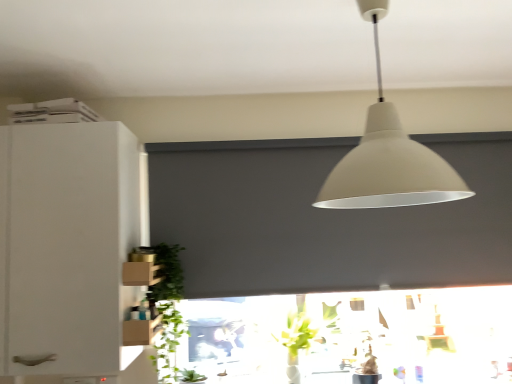
The height and width of the screenshot is (384, 512). Describe the element at coordinates (66, 244) in the screenshot. I see `white matte cabinet at left` at that location.

This screenshot has height=384, width=512. In order to click on matte white lampshade at upper center in this screenshot , I will do `click(388, 157)`.

Where is `green leafy plant at lower left`? Image resolution: width=512 pixels, height=384 pixels. green leafy plant at lower left is located at coordinates (168, 307).

Locate an element on the screen. matte gray window screen at center is located at coordinates (325, 219).

Who is shorter, white matte cabinet at left or matte white lampshade at upper center?

Standing shorter between the two is matte white lampshade at upper center.

At what (x,y) coordinates should I click in order to perform the action: click on cabinetry on the left of matte white lampshade at upper center. Please return your answer as a coordinate pair (x, y). This screenshot has width=512, height=384. Looking at the image, I should click on (66, 244).

Is white matte cabinet at left oriented away from matte white lampshade at upper center?

white matte cabinet at left is not turned away from matte white lampshade at upper center.

Can you tell me how much white matte cabinet at left and matte white lampshade at upper center differ in facing direction?

There is a 91-degree angle between the facing directions of white matte cabinet at left and matte white lampshade at upper center.

Based on the photo, which object is thinner, matte white lampshade at upper center or matte gray window screen at center?

matte gray window screen at center is thinner.

From a real-world perspective, is matte white lampshade at upper center positioned above or below matte gray window screen at center?

Clearly, from a real-world perspective, matte white lampshade at upper center is above matte gray window screen at center.

Identify the location of lamp lying on the left of matte gray window screen at center. (388, 157).

From the image's perspective, is matte white lampshade at upper center positioned above or below matte gray window screen at center?

Clearly, from the image's perspective, matte white lampshade at upper center is above matte gray window screen at center.

Which object is closer to the camera, green leafy plant at lower left or matte gray window screen at center?

green leafy plant at lower left is in front.

From the image's perspective, is green leafy plant at lower left located above matte gray window screen at center?

Incorrect, from the image's perspective, green leafy plant at lower left is lower than matte gray window screen at center.

Are green leafy plant at lower left and matte gray window screen at center far apart?

No, green leafy plant at lower left is in close proximity to matte gray window screen at center.

Is green leafy plant at lower left positioned with its back to matte gray window screen at center?

No, green leafy plant at lower left is not facing away from matte gray window screen at center.

The height and width of the screenshot is (384, 512). Find the location of `plant that appears in front of the matte gray window screen at center`. plant that appears in front of the matte gray window screen at center is located at coordinates (168, 307).

From the image's perspective, which is above, matte gray window screen at center or green leafy plant at lower left?

matte gray window screen at center is shown above in the image.

Which is in front, matte gray window screen at center or green leafy plant at lower left?

green leafy plant at lower left.

Consider the image. Which is correct: matte gray window screen at center is inside green leafy plant at lower left, or outside of it?

matte gray window screen at center is not inside green leafy plant at lower left, it's outside.

Is green leafy plant at lower left in front of or behind white matte cabinet at left in the image?

Visually, green leafy plant at lower left is located behind white matte cabinet at left.

Is green leafy plant at lower left outside of white matte cabinet at left?

Indeed, green leafy plant at lower left is completely outside white matte cabinet at left.

From the image's perspective, which one is positioned higher, green leafy plant at lower left or white matte cabinet at left?

white matte cabinet at left.

Could you tell me if green leafy plant at lower left is facing white matte cabinet at left?

No, green leafy plant at lower left is not oriented towards white matte cabinet at left.

Measure the distance from matte white lampshade at upper center to white matte cabinet at left.

The distance of matte white lampshade at upper center from white matte cabinet at left is 1.00 meters.

From the image's perspective, which one is positioned lower, matte white lampshade at upper center or white matte cabinet at left?

white matte cabinet at left, from the image's perspective.

Is matte white lampshade at upper center aimed at white matte cabinet at left?

No, matte white lampshade at upper center does not turn towards white matte cabinet at left.

Which of these two, matte white lampshade at upper center or white matte cabinet at left, is thinner?

Thinner between the two is white matte cabinet at left.

From a real-world perspective, which object stands above the other?

In real-world perspective, white matte cabinet at left is above.

In the scene shown: Is green leafy plant at lower left at the back of white matte cabinet at left?

No, green leafy plant at lower left is not at the back of white matte cabinet at left.

How different are the orientations of white matte cabinet at left and green leafy plant at lower left in degrees?

The angular difference between white matte cabinet at left and green leafy plant at lower left is 90 degrees.

Is white matte cabinet at left located outside green leafy plant at lower left?

Indeed, white matte cabinet at left is completely outside green leafy plant at lower left.

Locate an element on the screen. The image size is (512, 384). lamp that appears on the right of white matte cabinet at left is located at coordinates (388, 157).

At what (x,y) coordinates should I click in order to perform the action: click on lamp above the matte gray window screen at center (from a real-world perspective). Please return your answer as a coordinate pair (x, y). This screenshot has height=384, width=512. Looking at the image, I should click on (388, 157).

Based on their spatial positions, is matte gray window screen at center or white matte cabinet at left closer to green leafy plant at lower left?

white matte cabinet at left is positioned closer to the anchor green leafy plant at lower left.

From the image, which object appears to be farther from matte gray window screen at center, green leafy plant at lower left or white matte cabinet at left?

The object further to matte gray window screen at center is white matte cabinet at left.

Estimate the real-world distances between objects in this image. Which object is closer to matte white lampshade at upper center, green leafy plant at lower left or white matte cabinet at left?

Among the two, white matte cabinet at left is located nearer to matte white lampshade at upper center.

Looking at the image, which one is located further to green leafy plant at lower left, matte gray window screen at center or matte white lampshade at upper center?

Based on the image, matte white lampshade at upper center appears to be further to green leafy plant at lower left.

Estimate the real-world distances between objects in this image. Which object is closer to matte white lampshade at upper center, matte gray window screen at center or white matte cabinet at left?

matte gray window screen at center is closer to matte white lampshade at upper center.

Considering their positions, is matte white lampshade at upper center positioned further to white matte cabinet at left than green leafy plant at lower left?

matte white lampshade at upper center.

Which object lies further to the anchor point white matte cabinet at left, green leafy plant at lower left or matte white lampshade at upper center?

matte white lampshade at upper center is further to white matte cabinet at left.

When comparing their distances from white matte cabinet at left, does matte gray window screen at center or matte white lampshade at upper center seem further?

matte white lampshade at upper center is positioned further to the anchor white matte cabinet at left.

Where is `plant located between matte white lampshade at upper center and matte gray window screen at center in the depth direction`? The height and width of the screenshot is (384, 512). plant located between matte white lampshade at upper center and matte gray window screen at center in the depth direction is located at coordinates (168, 307).

This screenshot has height=384, width=512. Find the location of `plant located between white matte cabinet at left and matte gray window screen at center in the left-right direction`. plant located between white matte cabinet at left and matte gray window screen at center in the left-right direction is located at coordinates (168, 307).

Locate an element on the screen. This screenshot has height=384, width=512. plant located between white matte cabinet at left and matte white lampshade at upper center in the left-right direction is located at coordinates (168, 307).

Image resolution: width=512 pixels, height=384 pixels. Identify the location of lamp between white matte cabinet at left and matte gray window screen at center from left to right. click(x=388, y=157).